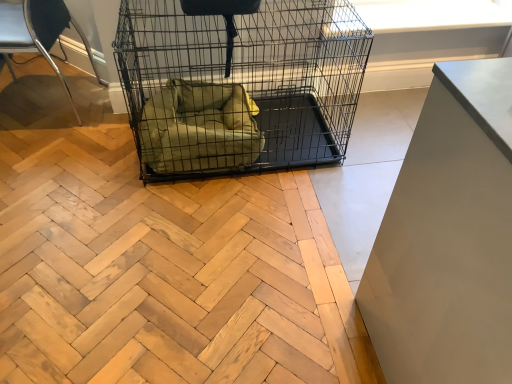
Find the location of a particular element. free space in front of black wire mesh cage at center is located at coordinates (204, 251).